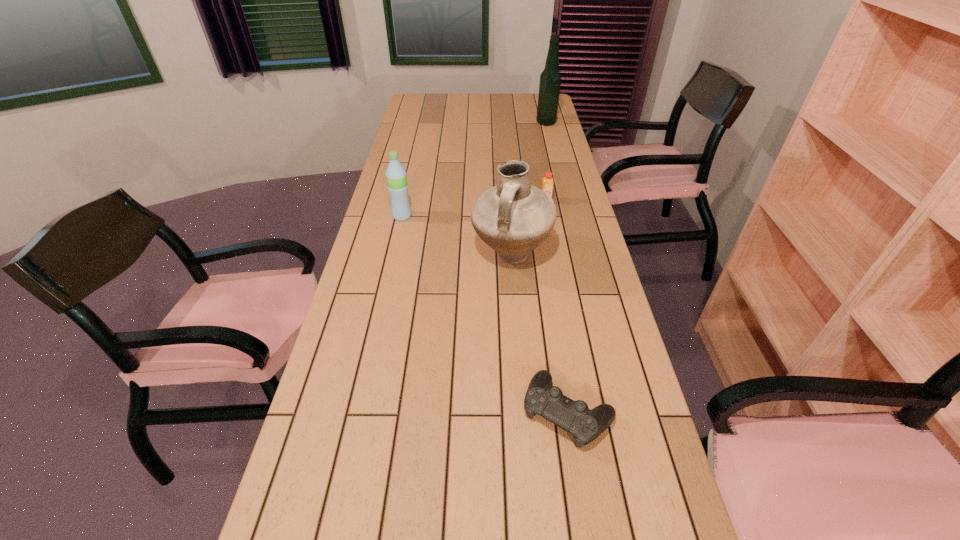
You are a GUI agent. You are given a task and a screenshot of the screen. Output one action in this format:
    pyautogui.click(x=<x>, y=<y>)
    Task: Click on the farthest object
    
    Given the screenshot: What is the action you would take?
    pyautogui.click(x=550, y=79)

Image resolution: width=960 pixels, height=540 pixels. What are the coordinates of `the tallest object` in the screenshot? It's located at (550, 79).

Locate an element on the screen. The width and height of the screenshot is (960, 540). the second tallest object is located at coordinates (513, 217).

Find the location of a particular element. This screenshot has width=960, height=540. pitcher is located at coordinates (513, 217).

Locate an element on the screen. the third tallest object is located at coordinates (396, 176).

I want to click on water bottle, so click(396, 176).

Where is `the second shortest object`? the second shortest object is located at coordinates (547, 186).

The width and height of the screenshot is (960, 540). I want to click on orange juice, so [547, 186].

Locate an element on the screen. the shortest object is located at coordinates (585, 425).

You are a GUI agent. You are given a task and a screenshot of the screen. Output one action in this format:
    pyautogui.click(x=<x>, y=<y>)
    Task: Click on the control
    This screenshot has height=540, width=960.
    Given the screenshot: What is the action you would take?
    pyautogui.click(x=585, y=425)